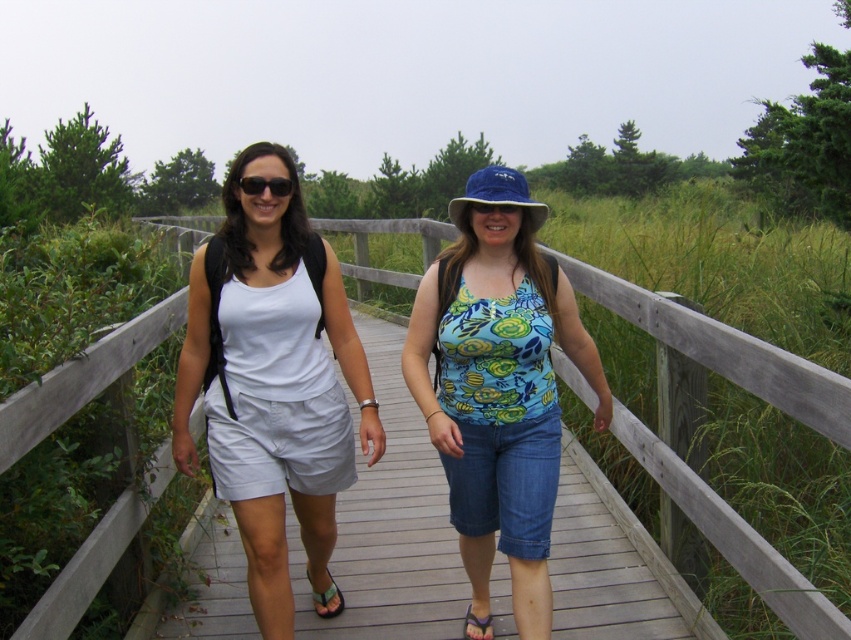
Question: Considering the real-world distances, which object is closest to the purple fabric sandal at lower center?

Choices:
 (A) blue fabric goggles at center
 (B) white cotton tank top at center

Answer: (B)

Question: Estimate the real-world distances between objects in this image. Which object is farther from the blue fabric goggles at center?

Choices:
 (A) matte black sunglasses at center
 (B) purple fabric sandal at lower center

Answer: (B)

Question: Does wooden bridge at center have a smaller size compared to purple fabric sandal at lower center?

Choices:
 (A) yes
 (B) no

Answer: (B)

Question: Can you confirm if blue fabric hat at center is thinner than green fabric sandal at lower center?

Choices:
 (A) no
 (B) yes

Answer: (A)

Question: Is white cotton tank top at center further to the viewer compared to blue printed tank top at center?

Choices:
 (A) no
 (B) yes

Answer: (A)

Question: Among these objects, which one is farthest from the camera?

Choices:
 (A) blue fabric goggles at center
 (B) white cotton tank top at center

Answer: (A)